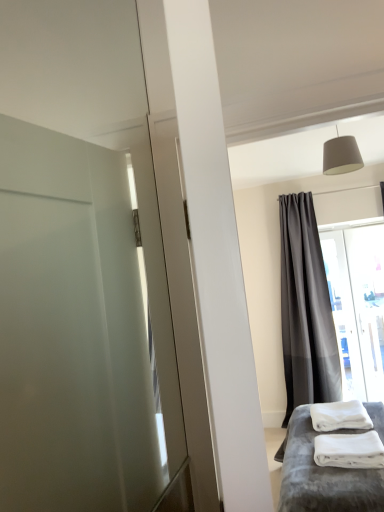
Question: Is white soft towels at lower right further to the viewer compared to matte gray lampshade at upper center?

Choices:
 (A) no
 (B) yes

Answer: (A)

Question: Is white soft towels at lower right not close to matte gray lampshade at upper center?

Choices:
 (A) no
 (B) yes

Answer: (B)

Question: From the image's perspective, does white soft towels at lower right appear higher than matte gray lampshade at upper center?

Choices:
 (A) yes
 (B) no

Answer: (B)

Question: Considering the relative sizes of white soft towels at lower right and matte gray lampshade at upper center in the image provided, is white soft towels at lower right shorter than matte gray lampshade at upper center?

Choices:
 (A) no
 (B) yes

Answer: (B)

Question: Is white soft towels at lower right to the left of matte gray lampshade at upper center from the viewer's perspective?

Choices:
 (A) yes
 (B) no

Answer: (A)

Question: From the image's perspective, relative to matte gray lampshade at upper center, is white fluffy bath towel at lower right above or below?

Choices:
 (A) below
 (B) above

Answer: (A)

Question: Is white fluffy bath towel at lower right inside or outside of matte gray lampshade at upper center?

Choices:
 (A) outside
 (B) inside

Answer: (A)

Question: Does point (362, 414) appear closer or farther from the camera than point (340, 163)?

Choices:
 (A) farther
 (B) closer

Answer: (B)

Question: From a real-world perspective, is white fluffy bath towel at lower right above or below matte gray lampshade at upper center?

Choices:
 (A) below
 (B) above

Answer: (A)

Question: Based on their positions, is white plush bed at lower right located to the left or right of matte gray lampshade at upper center?

Choices:
 (A) right
 (B) left

Answer: (B)

Question: From the image's perspective, is white plush bed at lower right above or below matte gray lampshade at upper center?

Choices:
 (A) below
 (B) above

Answer: (A)

Question: Is white plush bed at lower right taller or shorter than matte gray lampshade at upper center?

Choices:
 (A) tall
 (B) short

Answer: (A)

Question: Does point (360, 498) appear closer or farther from the camera than point (336, 145)?

Choices:
 (A) closer
 (B) farther

Answer: (A)

Question: Considering their positions, is white plush bed at lower right located in front of or behind dark gray sheer curtain at upper right?

Choices:
 (A) behind
 (B) front

Answer: (B)

Question: From a real-world perspective, is white plush bed at lower right physically located above or below dark gray sheer curtain at upper right?

Choices:
 (A) above
 (B) below

Answer: (B)